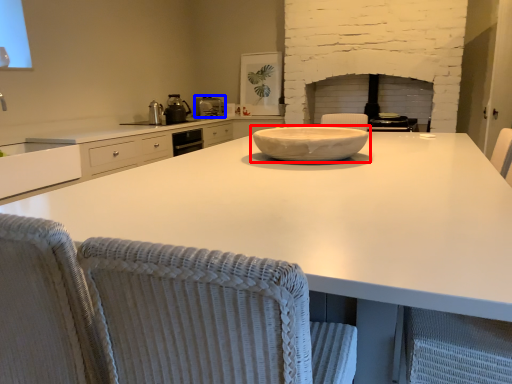
Question: Which object is closer to the camera taking this photo, bowl (highlighted by a red box) or kitchen appliance (highlighted by a blue box)?

Choices:
 (A) bowl
 (B) kitchen appliance

Answer: (A)